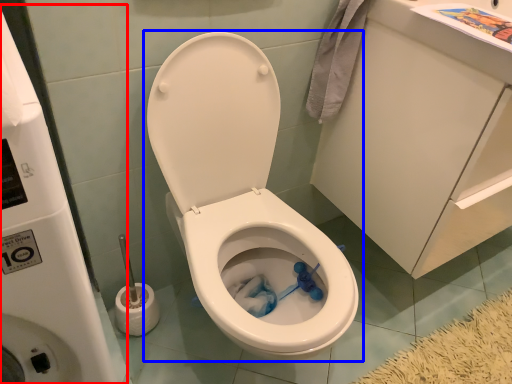
Question: Which point is closer to the camera, water tank (highlighted by a red box) or toilet (highlighted by a blue box)?

Choices:
 (A) water tank
 (B) toilet

Answer: (A)